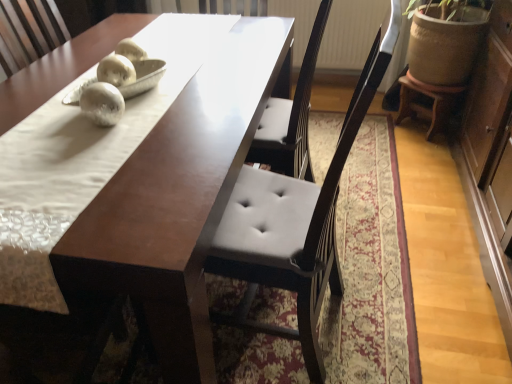
This screenshot has height=384, width=512. I want to click on white fabric mat at center, so click(x=371, y=270).

Where is `white fabric mat at center`? The height and width of the screenshot is (384, 512). white fabric mat at center is located at coordinates (371, 270).

Is wooden stool at right at the right side of white fabric mat at center?

Correct, you'll find wooden stool at right to the right of white fabric mat at center.

Which object is wider, wooden stool at right or white fabric mat at center?

white fabric mat at center.

From a real-world perspective, does wooden stool at right stand above white fabric mat at center?

No, from a real-world perspective, wooden stool at right is not on top of white fabric mat at center.

The height and width of the screenshot is (384, 512). What are the coordinates of `table on the left of wooden stool at right` in the screenshot? It's located at (179, 196).

From a real-world perspective, is wooden stool at right physically above matte brown table at center?

No, from a real-world perspective, wooden stool at right is not above matte brown table at center.

Would you say wooden stool at right is a long distance from matte brown table at center?

Yes, wooden stool at right is far from matte brown table at center.

Considering the positions of points (132, 246) and (360, 377), is point (132, 246) closer to camera compared to point (360, 377)?

That is True.

Looking at this image, considering the relative positions of matte brown table at center and white fabric mat at center in the image provided, is matte brown table at center to the right of white fabric mat at center from the viewer's perspective?

No.

Would you say matte brown table at center is outside white fabric mat at center?

matte brown table at center lies outside white fabric mat at center's area.

Which object is thinner, matte brown table at center or white fabric mat at center?

white fabric mat at center.

From the image's perspective, is white fabric mat at center under matte brown table at center?

Indeed, from the image's perspective, white fabric mat at center is shown beneath matte brown table at center.

Is white fabric mat at center positioned behind matte brown table at center?

No.

From a real-world perspective, is white fabric mat at center located beneath matte brown table at center?

Incorrect, from a real-world perspective, white fabric mat at center is higher than matte brown table at center.

Is white fabric mat at center behind wooden stool at right?

No, white fabric mat at center is closer to the camera.

Is point (393, 334) positioned after point (405, 111)?

That is False.

Measure the distance from white fabric mat at center to wooden stool at right.

white fabric mat at center and wooden stool at right are 79.17 centimeters apart.

Considering the sizes of white fabric mat at center and wooden stool at right in the image, is white fabric mat at center taller or shorter than wooden stool at right?

Considering their sizes, white fabric mat at center has more height than wooden stool at right.

Is matte brown table at center not close to wooden stool at right?

Yes, matte brown table at center is far from wooden stool at right.

From a real-world perspective, is matte brown table at center beneath wooden stool at right?

No.

What's the angular difference between matte brown table at center and wooden stool at right's facing directions?

→ matte brown table at center and wooden stool at right are facing 39.7 degrees away from each other.

Is matte brown table at center not within wooden stool at right?

That's correct, matte brown table at center is outside of wooden stool at right.

Locate an element on the screen. Image resolution: width=512 pixels, height=384 pixels. stool that is on the right side of white fabric mat at center is located at coordinates (426, 105).

You are a GUI agent. You are given a task and a screenshot of the screen. Output one action in this format:
    pyautogui.click(x=<x>, y=<y>)
    Task: Click on the table below the wooden stool at right (from the image's perspective)
    
    Given the screenshot: What is the action you would take?
    pyautogui.click(x=179, y=196)

Estimate the real-world distances between objects in this image. Which object is further from matte brown table at center, wooden stool at right or white fabric mat at center?

wooden stool at right.

Considering their positions, is matte brown table at center positioned further to white fabric mat at center than wooden stool at right?

The object further to white fabric mat at center is wooden stool at right.

Considering their positions, is white fabric mat at center positioned further to matte brown table at center than wooden stool at right?

wooden stool at right is positioned further to the anchor matte brown table at center.

Considering their positions, is matte brown table at center positioned further to wooden stool at right than white fabric mat at center?

matte brown table at center is further to wooden stool at right.

When comparing their distances from wooden stool at right, does white fabric mat at center or matte brown table at center seem further?

matte brown table at center.

When comparing their distances from white fabric mat at center, does wooden stool at right or matte brown table at center seem closer?

matte brown table at center is positioned closer to the anchor white fabric mat at center.

The height and width of the screenshot is (384, 512). I want to click on table between white fabric mat at center and wooden stool at right along the z-axis, so (x=179, y=196).